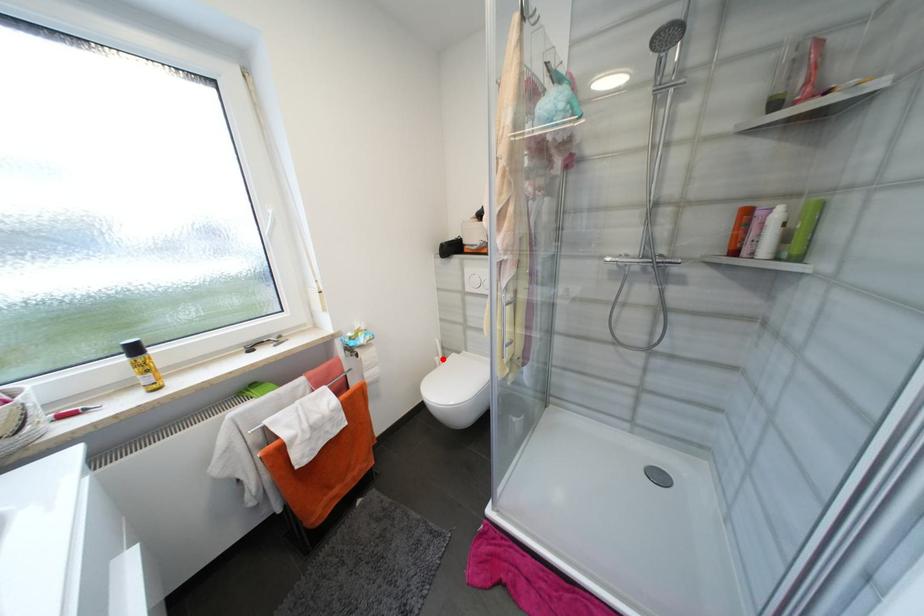
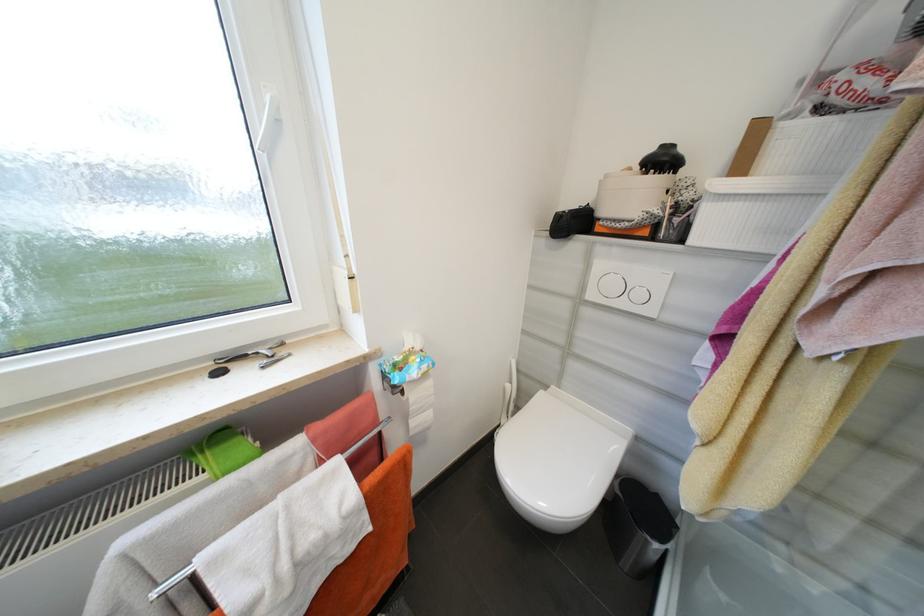
Question: I am providing you with two images of the same scene from different viewpoints. A red point is marked on the first image. Is the red point's position out of view in image 2?

Choices:
 (A) Yes
 (B) No

Answer: (B)